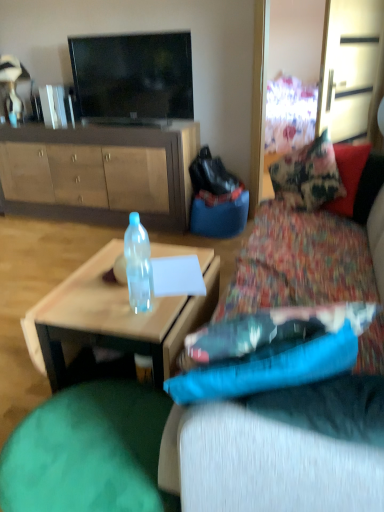
Question: Considering the relative sizes of textured fabric couch at center and translucent plastic coffee table at center in the image provided, is textured fabric couch at center wider than translucent plastic coffee table at center?

Choices:
 (A) no
 (B) yes

Answer: (A)

Question: Can you confirm if textured fabric couch at center is positioned to the right of translucent plastic coffee table at center?

Choices:
 (A) no
 (B) yes

Answer: (B)

Question: Is textured fabric couch at center not near translucent plastic coffee table at center?

Choices:
 (A) yes
 (B) no

Answer: (B)

Question: Is textured fabric couch at center looking in the opposite direction of translucent plastic coffee table at center?

Choices:
 (A) yes
 (B) no

Answer: (B)

Question: Considering the relative positions of textured fabric couch at center and translucent plastic coffee table at center in the image provided, is textured fabric couch at center behind translucent plastic coffee table at center?

Choices:
 (A) yes
 (B) no

Answer: (B)

Question: Is textured fabric couch at center closer to camera compared to translucent plastic coffee table at center?

Choices:
 (A) no
 (B) yes

Answer: (B)

Question: Is textured fabric couch at center oriented away from green fabric bean bag at lower left?

Choices:
 (A) no
 (B) yes

Answer: (A)

Question: Is textured fabric couch at center facing towards green fabric bean bag at lower left?

Choices:
 (A) no
 (B) yes

Answer: (A)

Question: Would you consider textured fabric couch at center to be distant from green fabric bean bag at lower left?

Choices:
 (A) no
 (B) yes

Answer: (A)

Question: Would you say green fabric bean bag at lower left is part of textured fabric couch at center's contents?

Choices:
 (A) yes
 (B) no

Answer: (B)

Question: Can you see textured fabric couch at center touching green fabric bean bag at lower left?

Choices:
 (A) yes
 (B) no

Answer: (B)

Question: Is textured fabric couch at center behind green fabric bean bag at lower left?

Choices:
 (A) no
 (B) yes

Answer: (A)

Question: From a real-world perspective, does green fabric bean bag at lower left stand above translucent plastic coffee table at center?

Choices:
 (A) no
 (B) yes

Answer: (A)